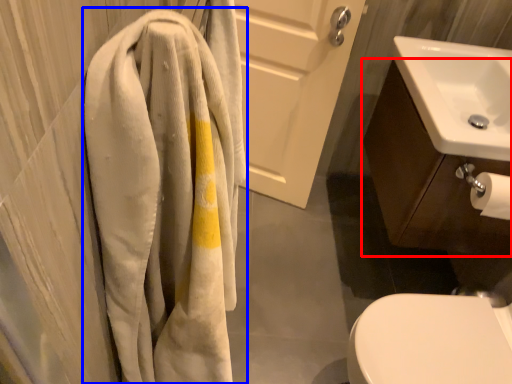
Question: Which point is further to the camera, bathroom cabinet (highlighted by a red box) or towel (highlighted by a blue box)?

Choices:
 (A) bathroom cabinet
 (B) towel

Answer: (A)